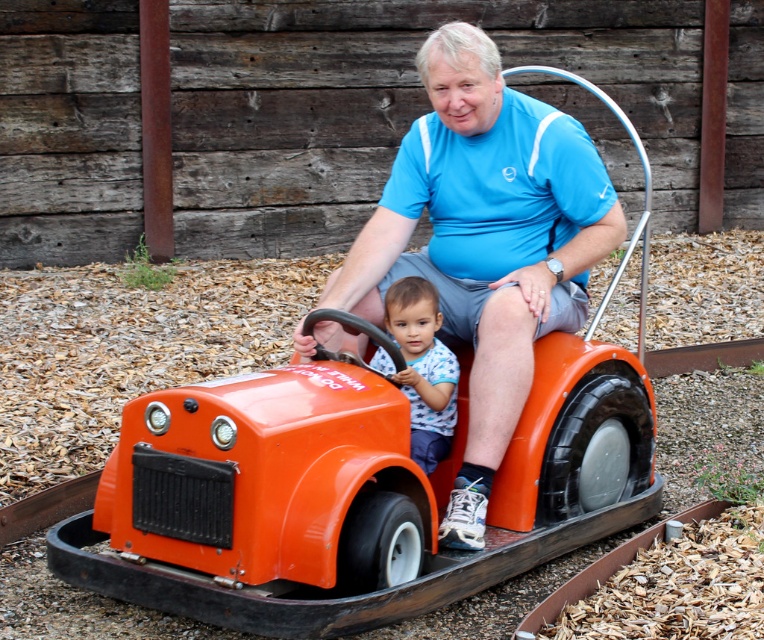
You are standing in a playground and see the orange plastic toy car at center and the matte blue shirt at center. Which object is positioned more to the left side?

The orange plastic toy car at center is positioned more to the left side than the matte blue shirt at center.

You are a photographer standing in front of the train car. You want to take a photo of both the matte blue shirt at center and the blue dotted shirt at center. Which one will appear larger in the photo?

The matte blue shirt at center will appear larger in the photo because it is closer to the viewer than the blue dotted shirt at center.